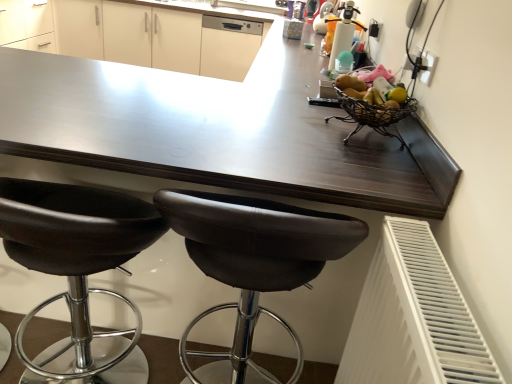
Question: Can you confirm if black plastic socket at upper right is positioned to the left of black leather stool at lower left, the second chair viewed from the right?

Choices:
 (A) no
 (B) yes

Answer: (A)

Question: Is black plastic socket at upper right completely or partially outside of black leather stool at lower left, the second chair viewed from the right?

Choices:
 (A) no
 (B) yes

Answer: (B)

Question: Is black plastic socket at upper right further to the viewer compared to black leather stool at lower left, arranged as the first chair when viewed from the left?

Choices:
 (A) yes
 (B) no

Answer: (A)

Question: Does black plastic socket at upper right have a lesser height compared to black leather stool at lower left, arranged as the first chair when viewed from the left?

Choices:
 (A) yes
 (B) no

Answer: (A)

Question: Can you confirm if black plastic socket at upper right is taller than black leather stool at lower left, arranged as the first chair when viewed from the left?

Choices:
 (A) yes
 (B) no

Answer: (B)

Question: Is brown leather stool at center, which is the second chair in left-to-right order, wider or thinner than white matte cabinet at upper center?

Choices:
 (A) thin
 (B) wide

Answer: (A)

Question: Considering the positions of brown leather stool at center, which is the second chair in left-to-right order, and white matte cabinet at upper center in the image, is brown leather stool at center, which is the second chair in left-to-right order, bigger or smaller than white matte cabinet at upper center?

Choices:
 (A) small
 (B) big

Answer: (A)

Question: From a real-world perspective, relative to white matte cabinet at upper center, is brown leather stool at center, which is the second chair in left-to-right order, vertically above or below?

Choices:
 (A) below
 (B) above

Answer: (A)

Question: In the image, is brown leather stool at center, which ranks as the first chair in right-to-left order, positioned in front of or behind white matte cabinet at upper center?

Choices:
 (A) front
 (B) behind

Answer: (A)

Question: Is white glossy dishwasher at upper center wider or thinner than black plastic socket at upper right?

Choices:
 (A) thin
 (B) wide

Answer: (B)

Question: Is white glossy dishwasher at upper center situated inside black plastic socket at upper right or outside?

Choices:
 (A) outside
 (B) inside

Answer: (A)

Question: Is white glossy dishwasher at upper center taller or shorter than black plastic socket at upper right?

Choices:
 (A) short
 (B) tall

Answer: (B)

Question: From a real-world perspective, is white glossy dishwasher at upper center physically located above or below black plastic socket at upper right?

Choices:
 (A) below
 (B) above

Answer: (A)

Question: Choose the correct answer: Is white plastic radiator at lower right inside white matte cabinet at upper center or outside it?

Choices:
 (A) inside
 (B) outside

Answer: (B)

Question: From the image's perspective, is white plastic radiator at lower right above or below white matte cabinet at upper center?

Choices:
 (A) below
 (B) above

Answer: (A)